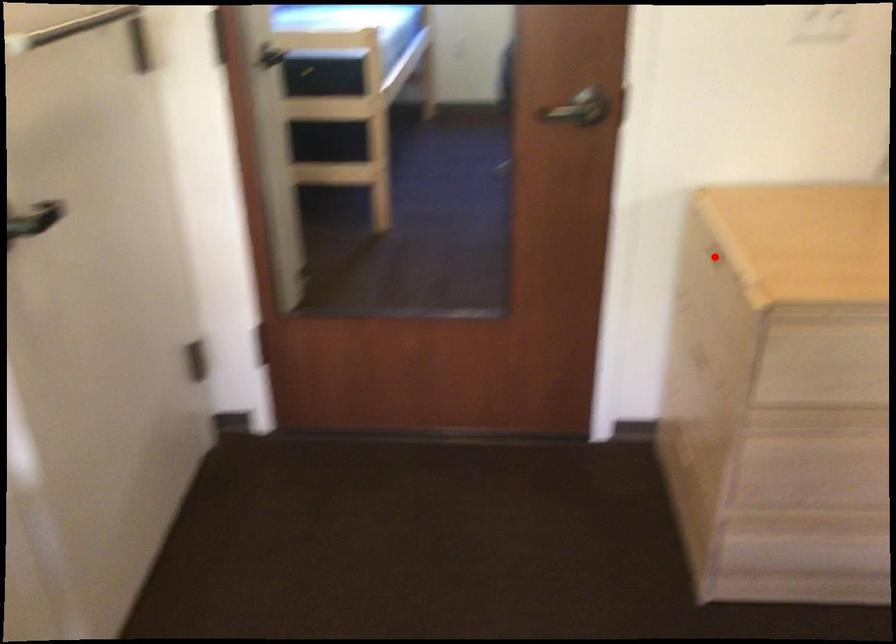
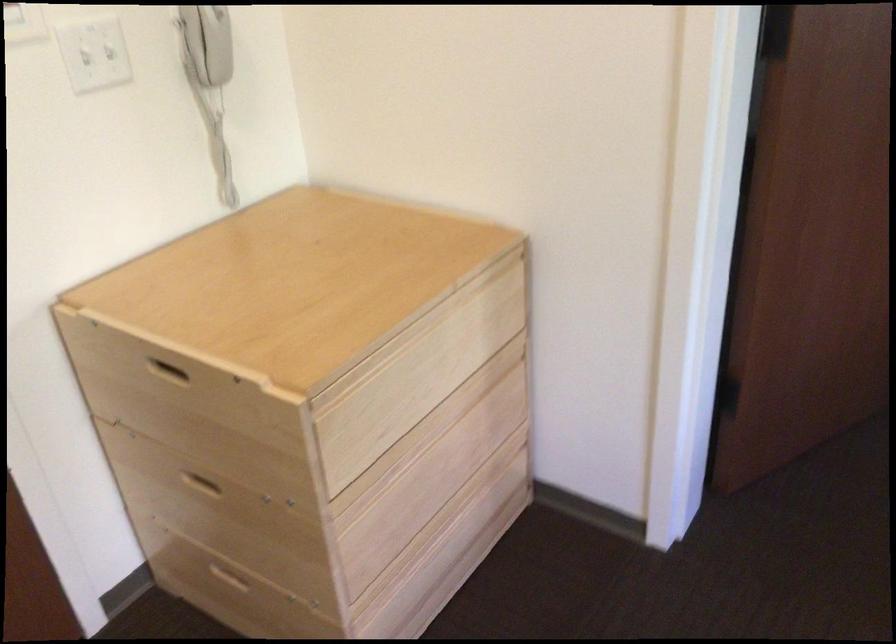
The point at the highlighted location is marked in the first image. Where is the corresponding point in the second image?

(168, 372)